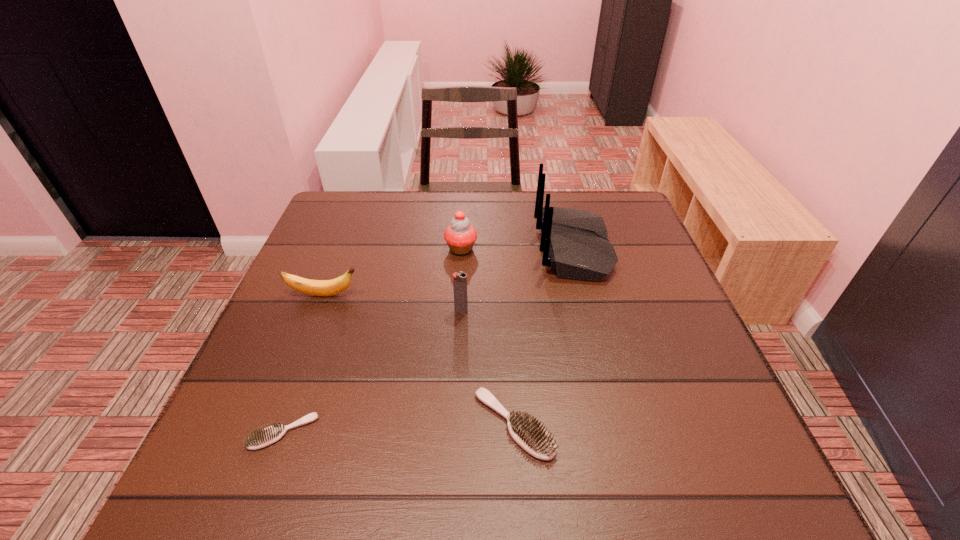
Where is `blank area in the image that satisfies the following two spatial constraints: 1. on the back side of the igniter; 2. at the stem of the fourth tallest object`? This screenshot has width=960, height=540. blank area in the image that satisfies the following two spatial constraints: 1. on the back side of the igniter; 2. at the stem of the fourth tallest object is located at coordinates (462, 295).

Where is `free space that satisfies the following two spatial constraints: 1. on the back side of the fourth farthest object; 2. at the stem of the banana`? free space that satisfies the following two spatial constraints: 1. on the back side of the fourth farthest object; 2. at the stem of the banana is located at coordinates (462, 295).

In order to click on vacant position in the image that satisfies the following two spatial constraints: 1. at the stem of the fifth tallest object; 2. on the left side of the third shortest object in this screenshot , I will do `click(275, 424)`.

Locate an element on the screen. This screenshot has height=540, width=960. vacant region that satisfies the following two spatial constraints: 1. on the back side of the shortest object; 2. on the right side of the cupcake is located at coordinates (350, 249).

This screenshot has height=540, width=960. Find the location of `vacant space that satisfies the following two spatial constraints: 1. at the stem of the banana; 2. on the back side of the fourth farthest object`. vacant space that satisfies the following two spatial constraints: 1. at the stem of the banana; 2. on the back side of the fourth farthest object is located at coordinates (318, 311).